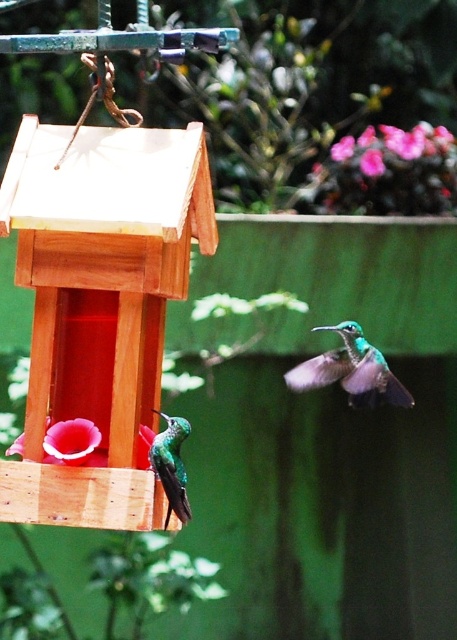
Question: Can you confirm if pink matte flower at upper right is bigger than pink matte flower at upper center?

Choices:
 (A) yes
 (B) no

Answer: (B)

Question: Which object is the farthest from the green iridescent hummingbird at center?

Choices:
 (A) pink matte flower at upper right
 (B) pink matte flower at lower left

Answer: (A)

Question: Based on their relative distances, which object is nearer to the pink matte flower at lower left?

Choices:
 (A) pink matte flower at upper center
 (B) pink matte flower at upper right
 (C) green iridescent hummingbird at center
 (D) green iridescent hummingbird at lower left

Answer: (D)

Question: Among these objects, which one is farthest from the camera?

Choices:
 (A) pink matte flower at lower left
 (B) pink matte flower at upper center
 (C) green iridescent hummingbird at lower left

Answer: (B)

Question: Is green iridescent hummingbird at lower left below pink matte flower at upper center?

Choices:
 (A) no
 (B) yes

Answer: (B)

Question: Does green iridescent hummingbird at center have a smaller size compared to pink matte flower at upper right?

Choices:
 (A) yes
 (B) no

Answer: (B)